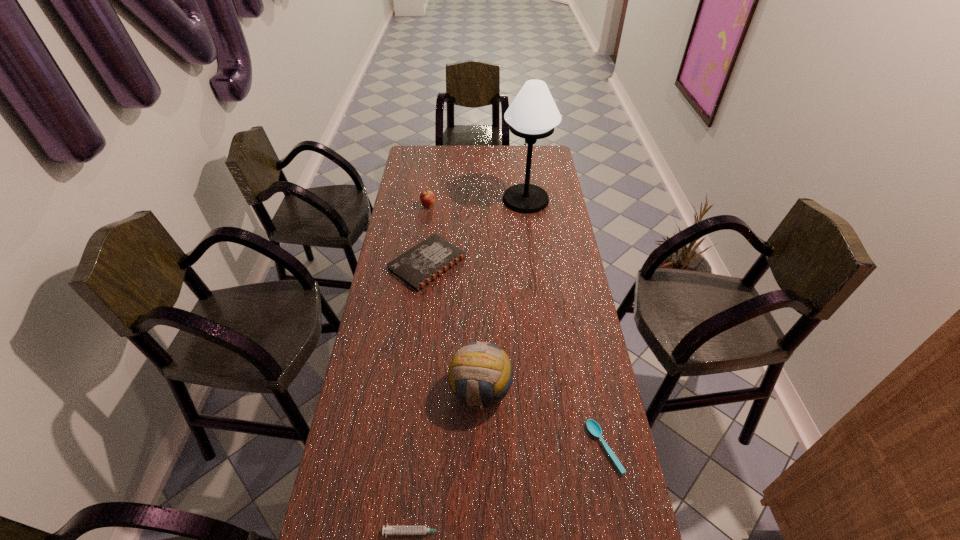
Where is `free spot at the far edge of the desktop`? free spot at the far edge of the desktop is located at coordinates (519, 148).

Where is `vacant space at the left edge`? The width and height of the screenshot is (960, 540). vacant space at the left edge is located at coordinates (419, 206).

Image resolution: width=960 pixels, height=540 pixels. Identify the location of vacant space at the right edge of the desktop. (603, 528).

Identify the location of free spot between the second tallest object and the table lamp. Image resolution: width=960 pixels, height=540 pixels. (503, 295).

The image size is (960, 540). In order to click on free spot between the nearest object and the shortest object in this screenshot , I will do `click(510, 490)`.

You are a GUI agent. You are given a task and a screenshot of the screen. Output one action in this format:
    pyautogui.click(x=<x>, y=<y>)
    Task: Click on the free spot between the apple and the volleyball
    
    Given the screenshot: What is the action you would take?
    pyautogui.click(x=454, y=299)

Where is `free spot between the nearest object and the volleyball`? The height and width of the screenshot is (540, 960). free spot between the nearest object and the volleyball is located at coordinates (448, 461).

Where is `free space that is in between the shortest object and the fourth nearest object`? This screenshot has width=960, height=540. free space that is in between the shortest object and the fourth nearest object is located at coordinates (516, 355).

This screenshot has width=960, height=540. I want to click on empty space that is in between the fifth shortest object and the spoon, so click(542, 419).

Identify the location of free space between the fifth farthest object and the fourth nearest object. The image size is (960, 540). (516, 355).